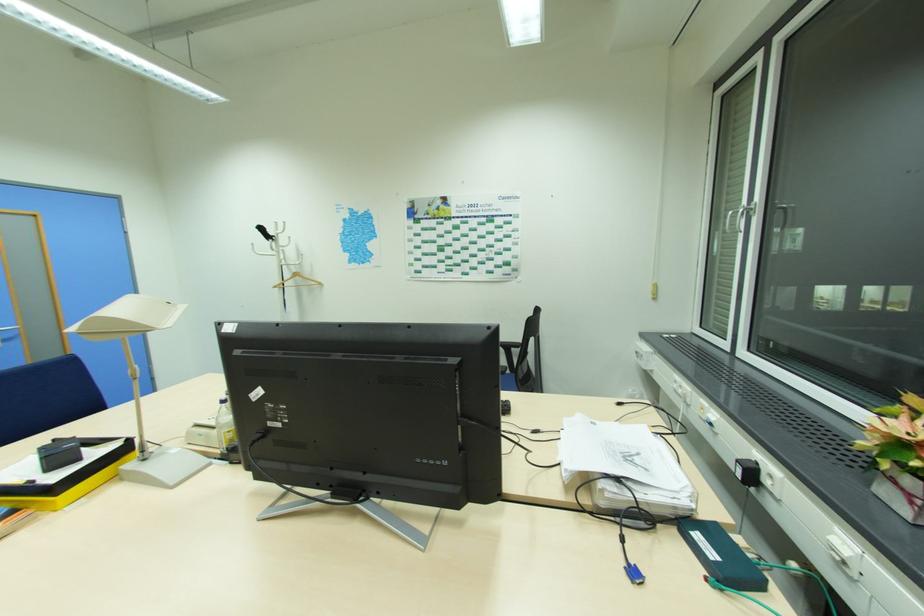
What do you see at coordinates (511, 346) in the screenshot?
I see `the black chair armrest` at bounding box center [511, 346].